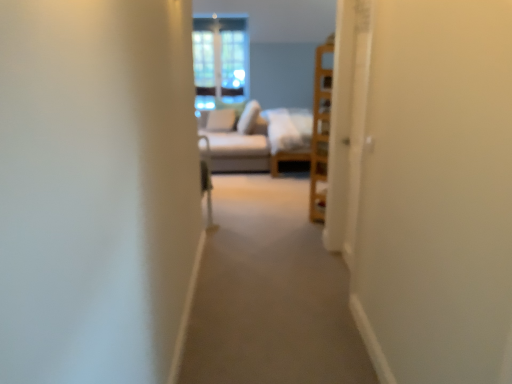
The height and width of the screenshot is (384, 512). What are the coordinates of `white soft pillow at center, the second pillow in the left-to-right sequence` in the screenshot? It's located at (249, 118).

Image resolution: width=512 pixels, height=384 pixels. Describe the element at coordinates (249, 118) in the screenshot. I see `white soft pillow at center, the second pillow in the left-to-right sequence` at that location.

This screenshot has width=512, height=384. Describe the element at coordinates (288, 135) in the screenshot. I see `light beige fabric couch at center` at that location.

Locate an element on the screen. white soft pillow at center, the second pillow in the left-to-right sequence is located at coordinates (249, 118).

From the picture: Which is in front, clear glass window at center or white soft pillow at center, which is the 1th pillow from right to left?

white soft pillow at center, which is the 1th pillow from right to left.

Who is smaller, clear glass window at center or white soft pillow at center, the second pillow in the left-to-right sequence?

clear glass window at center is smaller.

From the image's perspective, is clear glass window at center positioned above or below white soft pillow at center, which is the 1th pillow from right to left?

clear glass window at center is situated higher than white soft pillow at center, which is the 1th pillow from right to left, in the image.

Is clear glass window at center in front of or behind white soft pillow at center, the 1th pillow viewed from the left, in the image?

Answer: clear glass window at center is behind white soft pillow at center, the 1th pillow viewed from the left.

How much distance is there between clear glass window at center and white soft pillow at center, the 1th pillow viewed from the left?

The distance of clear glass window at center from white soft pillow at center, the 1th pillow viewed from the left, is 67.82 centimeters.

Does clear glass window at center have a greater height compared to white soft pillow at center, which ranks as the 2th pillow in right-to-left order?

Correct, clear glass window at center is much taller as white soft pillow at center, which ranks as the 2th pillow in right-to-left order.

Visually, is clear glass window at center positioned to the left or to the right of white soft pillow at center, the 1th pillow viewed from the left?

clear glass window at center is positioned on white soft pillow at center, the 1th pillow viewed from the left,'s left side.

Is white soft pillow at center, the 1th pillow viewed from the left, next to white soft pillow at center, the second pillow in the left-to-right sequence?

white soft pillow at center, the 1th pillow viewed from the left, and white soft pillow at center, the second pillow in the left-to-right sequence, are clearly separated.

Who is shorter, white soft pillow at center, the 1th pillow viewed from the left, or white soft pillow at center, which is the 1th pillow from right to left?

With less height is white soft pillow at center, which is the 1th pillow from right to left.

Which is more to the right, white soft pillow at center, which ranks as the 2th pillow in right-to-left order, or white soft pillow at center, which is the 1th pillow from right to left?

white soft pillow at center, which is the 1th pillow from right to left.

Could you measure the distance between white soft pillow at center, which is the 1th pillow from right to left, and light beige fabric couch at center?

They are 20.33 inches apart.

Is white soft pillow at center, which is the 1th pillow from right to left, looking in the opposite direction of light beige fabric couch at center?

Yes, white soft pillow at center, which is the 1th pillow from right to left, is facing away from light beige fabric couch at center.

From a real-world perspective, is white soft pillow at center, the second pillow in the left-to-right sequence, above or below light beige fabric couch at center?

In terms of real-world spatial position, white soft pillow at center, the second pillow in the left-to-right sequence, is above light beige fabric couch at center.

Between white soft pillow at center, the second pillow in the left-to-right sequence, and light beige fabric couch at center, which one has more height?

With more height is light beige fabric couch at center.

Where is `couch below the clear glass window at center (from a real-world perspective)`? The image size is (512, 384). couch below the clear glass window at center (from a real-world perspective) is located at coordinates (288, 135).

Is clear glass window at center oriented away from light beige fabric couch at center?

No.

From the image's perspective, would you say clear glass window at center is positioned over light beige fabric couch at center?

Yes, from the image's perspective, clear glass window at center is over light beige fabric couch at center.

Is light beige fabric couch at center behind white soft pillow at center, which is the 1th pillow from right to left?

No, it is in front of white soft pillow at center, which is the 1th pillow from right to left.

This screenshot has width=512, height=384. I want to click on the 1st pillow behind when counting from the light beige fabric couch at center, so click(x=249, y=118).

How far apart are light beige fabric couch at center and white soft pillow at center, the second pillow in the left-to-right sequence?

They are 20.33 inches apart.

From a real-world perspective, is light beige fabric couch at center positioned above or below white soft pillow at center, the second pillow in the left-to-right sequence?

light beige fabric couch at center is situated lower than white soft pillow at center, the second pillow in the left-to-right sequence, in the real world.

Is point (281, 125) positioned behind point (227, 129)?

No, it is not.

Looking at this image, from a real-world perspective, is light beige fabric couch at center positioned over white soft pillow at center, which ranks as the 2th pillow in right-to-left order, based on gravity?

No.

Which is more to the left, light beige fabric couch at center or white soft pillow at center, the 1th pillow viewed from the left?

From the viewer's perspective, white soft pillow at center, the 1th pillow viewed from the left, appears more on the left side.

From a real-world perspective, which pillow is the 1st one underneath the clear glass window at center? Please provide its 2D coordinates.

[(249, 118)]

Locate an element on the screen. Image resolution: width=512 pixels, height=384 pixels. window lying behind the white soft pillow at center, the 1th pillow viewed from the left is located at coordinates (220, 60).

Estimate the real-world distances between objects in this image. Which object is closer to white soft pillow at center, the second pillow in the left-to-right sequence, clear glass window at center or light beige fabric couch at center?

light beige fabric couch at center lies closer to white soft pillow at center, the second pillow in the left-to-right sequence, than the other object.

Which object lies nearer to the anchor point light beige fabric couch at center, white soft pillow at center, the second pillow in the left-to-right sequence, or clear glass window at center?

Among the two, white soft pillow at center, the second pillow in the left-to-right sequence, is located nearer to light beige fabric couch at center.

From the image, which object appears to be nearer to clear glass window at center, white soft pillow at center, which is the 1th pillow from right to left, or white soft pillow at center, the 1th pillow viewed from the left?

white soft pillow at center, the 1th pillow viewed from the left, is closer to clear glass window at center.

Based on their spatial positions, is white soft pillow at center, which is the 1th pillow from right to left, or white soft pillow at center, which ranks as the 2th pillow in right-to-left order, closer to light beige fabric couch at center?

white soft pillow at center, which is the 1th pillow from right to left.

When comparing their distances from white soft pillow at center, the 1th pillow viewed from the left, does light beige fabric couch at center or white soft pillow at center, which is the 1th pillow from right to left, seem further?

Based on the image, light beige fabric couch at center appears to be further to white soft pillow at center, the 1th pillow viewed from the left.

Estimate the real-world distances between objects in this image. Which object is further from white soft pillow at center, the 1th pillow viewed from the left, light beige fabric couch at center or clear glass window at center?

light beige fabric couch at center.

Estimate the real-world distances between objects in this image. Which object is further from white soft pillow at center, the second pillow in the left-to-right sequence, white soft pillow at center, which ranks as the 2th pillow in right-to-left order, or light beige fabric couch at center?

Among the two, light beige fabric couch at center is located further to white soft pillow at center, the second pillow in the left-to-right sequence.

Which object lies further to the anchor point clear glass window at center, light beige fabric couch at center or white soft pillow at center, which is the 1th pillow from right to left?

light beige fabric couch at center is positioned further to the anchor clear glass window at center.

This screenshot has height=384, width=512. I want to click on pillow positioned between light beige fabric couch at center and white soft pillow at center, which ranks as the 2th pillow in right-to-left order, from near to far, so click(249, 118).

I want to click on pillow located between white soft pillow at center, which is the 1th pillow from right to left, and clear glass window at center in the depth direction, so click(221, 120).